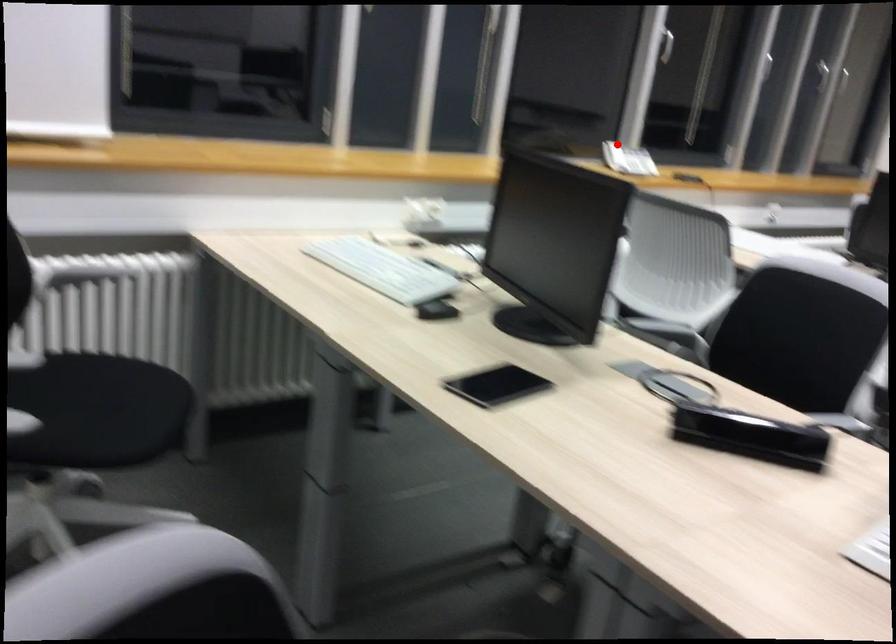
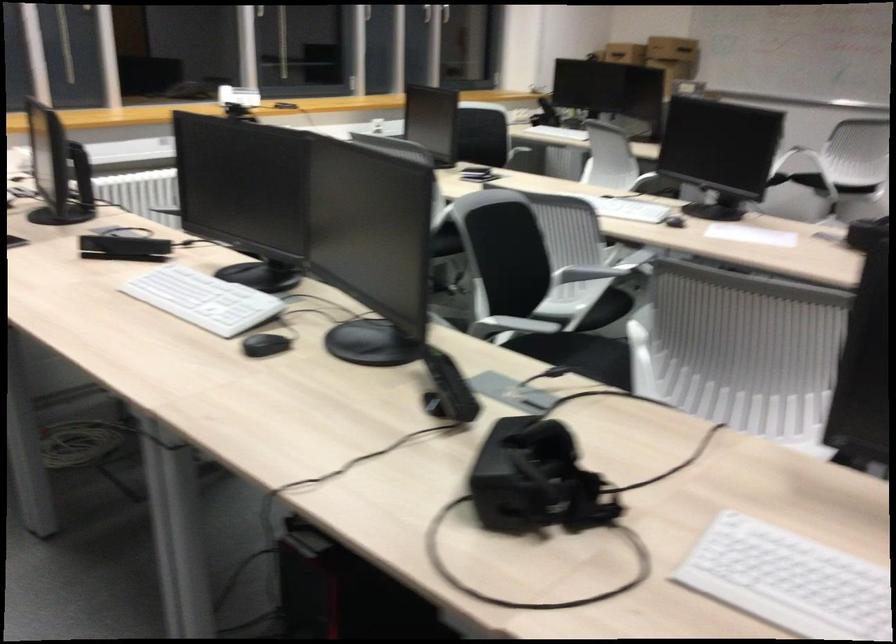
Question: I am providing you with two images of the same scene from different viewpoints. A red point is shown in image1. For the corresponding object point in image2, is it positioned nearer or farther from the camera?

Choices:
 (A) Nearer
 (B) Farther

Answer: (B)